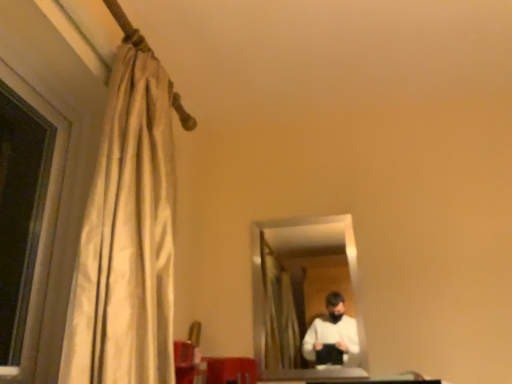
Question: Considering the positions of point (283, 357) and point (161, 155), is point (283, 357) closer or farther from the camera than point (161, 155)?

Choices:
 (A) closer
 (B) farther

Answer: (B)

Question: Do you think clear glass mirror at center is within beige fabric curtain at left, or outside of it?

Choices:
 (A) outside
 (B) inside

Answer: (A)

Question: From the image's perspective, is clear glass mirror at center above or below beige fabric curtain at left?

Choices:
 (A) above
 (B) below

Answer: (B)

Question: Is point 137,268 positioned closer to the camera than point 315,256?

Choices:
 (A) closer
 (B) farther

Answer: (A)

Question: Considering the positions of beige fabric curtain at left and clear glass mirror at center in the image, is beige fabric curtain at left wider or thinner than clear glass mirror at center?

Choices:
 (A) wide
 (B) thin

Answer: (A)

Question: From a real-world perspective, is beige fabric curtain at left physically located above or below clear glass mirror at center?

Choices:
 (A) above
 (B) below

Answer: (A)

Question: Is beige fabric curtain at left taller or shorter than clear glass mirror at center?

Choices:
 (A) short
 (B) tall

Answer: (B)